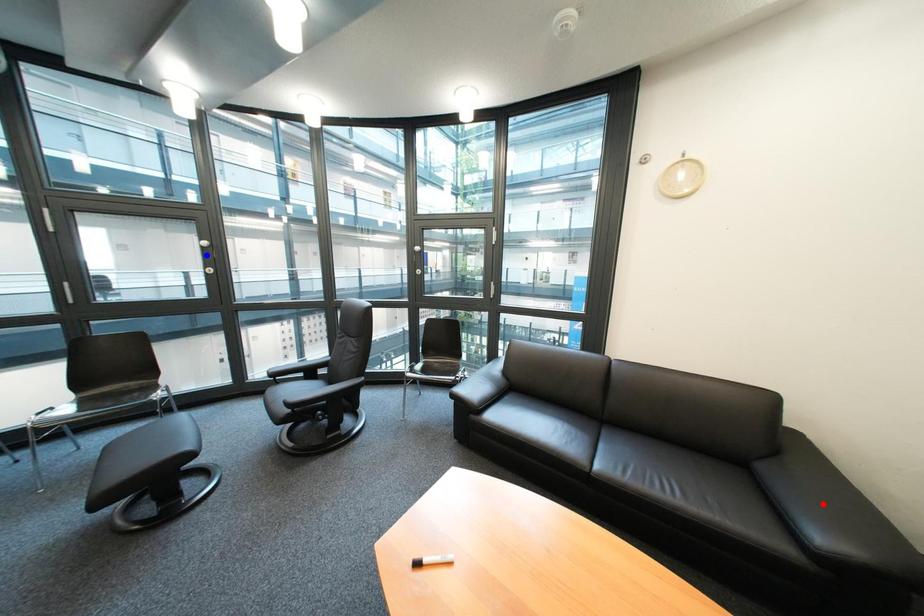
Question: In the image, two points are highlighted. Which point is nearer to the camera? Reply with the corresponding letter.

Choices:
 (A) blue point
 (B) red point

Answer: (B)